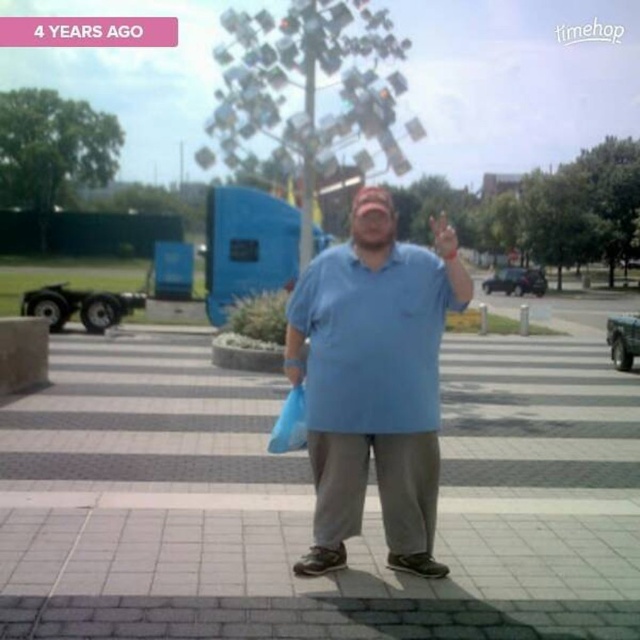
You are a delivery person who needs to hand over a package to someone wearing a blue cotton polo shirt at center. You are currently holding a matte plastic hand at center. Can you reach the person without moving closer than 6 meters?

The blue cotton polo shirt at center and matte plastic hand at center are 6.91 meters apart from each other. Since the distance is more than 6 meters, you cannot reach the person without moving closer.